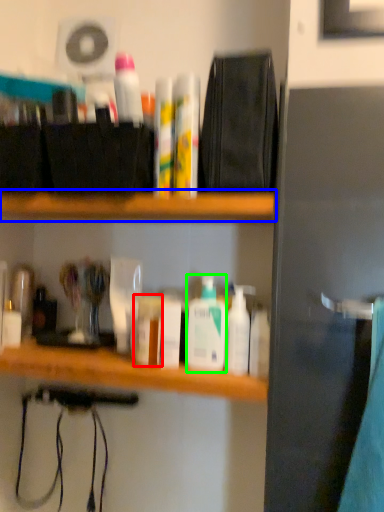
Question: Estimate the real-world distances between objects in this image. Which object is closer to toiletry (highlighted by a red box), shelf (highlighted by a blue box) or toiletry (highlighted by a green box)?

Choices:
 (A) shelf
 (B) toiletry

Answer: (B)